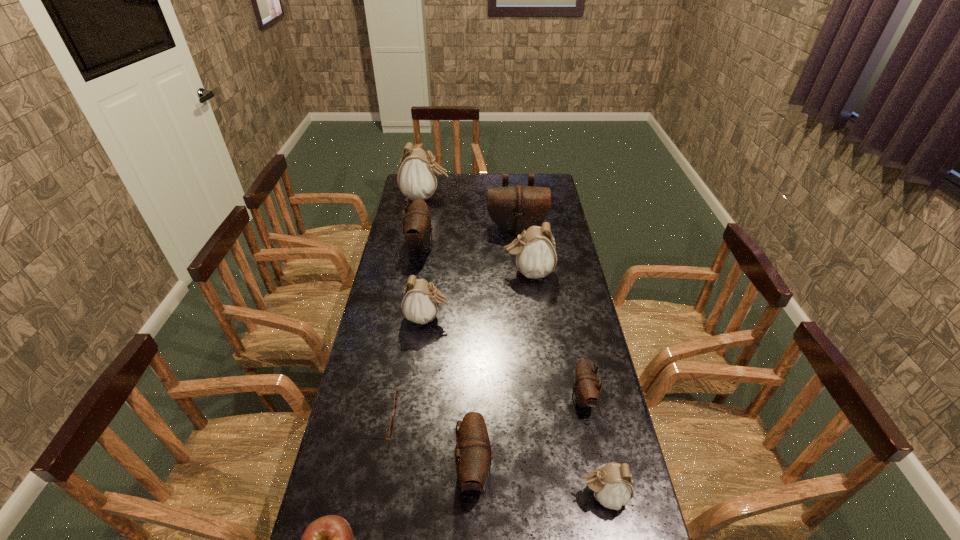
Where is `the farthest pouch`? The image size is (960, 540). the farthest pouch is located at coordinates (417, 177).

Find the location of a particular element. The image size is (960, 540). the biggest white pouch is located at coordinates (417, 177).

This screenshot has width=960, height=540. Find the location of `the biggest brown pouch`. the biggest brown pouch is located at coordinates (515, 208).

Locate an element on the screen. the second biggest white pouch is located at coordinates (535, 251).

Locate an element on the screen. the leftmost brown pouch is located at coordinates (417, 227).

Identify the location of the sixth nearest object. Image resolution: width=960 pixels, height=540 pixels. coord(420,302).

Where is `the fourth nearest pouch`? The width and height of the screenshot is (960, 540). the fourth nearest pouch is located at coordinates (420, 302).

Find the location of a particular element. The width and height of the screenshot is (960, 540). the nearest brown pouch is located at coordinates (473, 455).

Identify the location of the smallest white pouch. This screenshot has height=540, width=960. (612, 484).

The image size is (960, 540). Find the location of `the smallest brown pouch`. the smallest brown pouch is located at coordinates (586, 389).